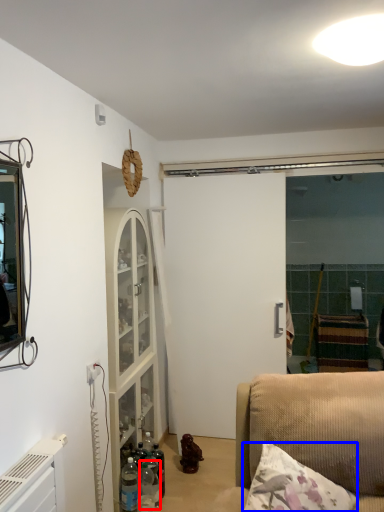
Question: Which object appears farthest to the camera in this image, bottle (highlighted by a red box) or pillow (highlighted by a blue box)?

Choices:
 (A) bottle
 (B) pillow

Answer: (A)